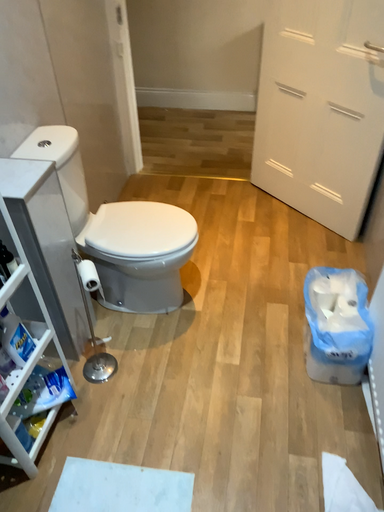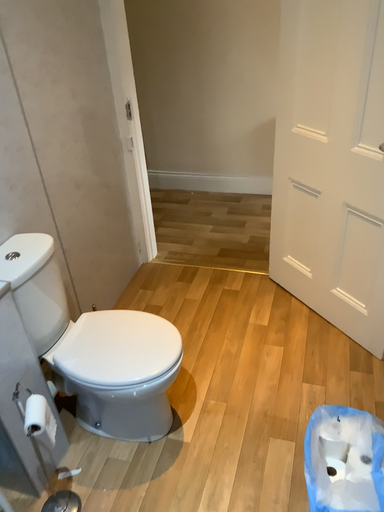
Question: How did the camera likely rotate when shooting the video?

Choices:
 (A) rotated right
 (B) rotated left

Answer: (B)